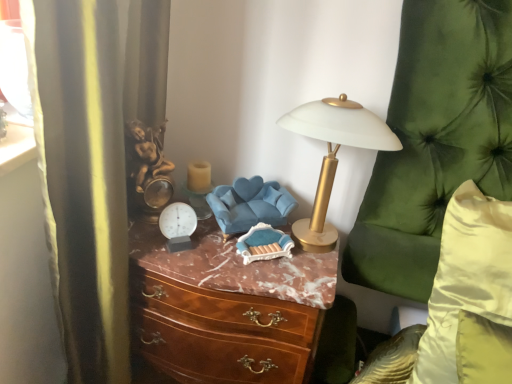
What do you see at coordinates (199, 187) in the screenshot? The width and height of the screenshot is (512, 384). I see `translucent glass candle at center` at bounding box center [199, 187].

What do you see at coordinates (250, 204) in the screenshot? I see `blue fabric swivel chair at center` at bounding box center [250, 204].

This screenshot has width=512, height=384. Describe the element at coordinates (466, 278) in the screenshot. I see `silky yellow pillow at right` at that location.

This screenshot has height=384, width=512. In order to click on silky yellow pillow at right in this screenshot , I will do `click(466, 278)`.

This screenshot has height=384, width=512. What do you see at coordinates (333, 155) in the screenshot? I see `gold metallic table lamp at upper center` at bounding box center [333, 155].

The image size is (512, 384). I want to click on translucent glass candle at center, so click(x=199, y=187).

Based on the photo, which of these two, translucent glass candle at center or marble/wooden chest of drawers at center, is smaller?

translucent glass candle at center is smaller.

How much distance is there between translucent glass candle at center and marble/wooden chest of drawers at center?

A distance of 11.73 inches exists between translucent glass candle at center and marble/wooden chest of drawers at center.

Locate an element on the screen. the chest of drawers that appears in front of the translucent glass candle at center is located at coordinates tap(226, 308).

What are the coordinates of `lamp above the blue fabric swivel chair at center (from the image's perspective)` in the screenshot? It's located at coord(333,155).

Between blue fabric swivel chair at center and gold metallic table lamp at upper center, which one appears on the left side from the viewer's perspective?

Positioned to the left is blue fabric swivel chair at center.

Considering the positions of objects blue fabric swivel chair at center and gold metallic table lamp at upper center in the image provided, who is in front, blue fabric swivel chair at center or gold metallic table lamp at upper center?

gold metallic table lamp at upper center is closer to the camera.

Between blue fabric swivel chair at center and gold metallic table lamp at upper center, which one has smaller width?

blue fabric swivel chair at center is thinner.

From a real-world perspective, is translucent glass candle at center located beneath silky yellow pillow at right?

Incorrect, from a real-world perspective, translucent glass candle at center is higher than silky yellow pillow at right.

From the image's perspective, which is below, translucent glass candle at center or silky yellow pillow at right?

silky yellow pillow at right, from the image's perspective.

Considering the relative sizes of translucent glass candle at center and silky yellow pillow at right in the image provided, is translucent glass candle at center shorter than silky yellow pillow at right?

Indeed, translucent glass candle at center has a lesser height compared to silky yellow pillow at right.

Is translucent glass candle at center next to silky yellow pillow at right and touching it?

No, translucent glass candle at center is not in contact with silky yellow pillow at right.

Which of these two, blue fabric swivel chair at center or silky yellow pillow at right, stands taller?

silky yellow pillow at right.

From the image's perspective, is blue fabric swivel chair at center above or below silky yellow pillow at right?

blue fabric swivel chair at center is above silky yellow pillow at right.

Which object is positioned more to the left, marble/wooden chest of drawers at center or translucent glass candle at center?

translucent glass candle at center is more to the left.

Which of these two, marble/wooden chest of drawers at center or translucent glass candle at center, is wider?

marble/wooden chest of drawers at center is wider.

Is marble/wooden chest of drawers at center smaller than translucent glass candle at center?

Actually, marble/wooden chest of drawers at center might be larger than translucent glass candle at center.

Is point (310, 286) farther from camera compared to point (196, 180)?

No, (310, 286) is closer to viewer.

Considering the sizes of translucent glass candle at center and gold metallic table lamp at upper center in the image, is translucent glass candle at center taller or shorter than gold metallic table lamp at upper center?

translucent glass candle at center is shorter than gold metallic table lamp at upper center.

Consider the image. Which object is wider, translucent glass candle at center or gold metallic table lamp at upper center?

Wider between the two is gold metallic table lamp at upper center.

Choose the correct answer: Is translucent glass candle at center inside gold metallic table lamp at upper center or outside it?

translucent glass candle at center cannot be found inside gold metallic table lamp at upper center.

From a real-world perspective, is translucent glass candle at center under gold metallic table lamp at upper center?

Yes, from a real-world perspective, translucent glass candle at center is beneath gold metallic table lamp at upper center.

How far apart are blue fabric swivel chair at center and translucent glass candle at center?

4.74 inches.

Is translucent glass candle at center inside blue fabric swivel chair at center?

No, translucent glass candle at center is not surrounded by blue fabric swivel chair at center.

Can you tell me how much blue fabric swivel chair at center and translucent glass candle at center differ in facing direction?

The angular difference between blue fabric swivel chair at center and translucent glass candle at center is 1.71 degrees.

In the scene shown: From the image's perspective, is blue fabric swivel chair at center above or below translucent glass candle at center?

From the image's perspective, blue fabric swivel chair at center appears below translucent glass candle at center.

Identify the location of candle holder on the left of marble/wooden chest of drawers at center. (199, 187).

Locate an element on the screen. The height and width of the screenshot is (384, 512). swivel chair that appears below the gold metallic table lamp at upper center (from a real-world perspective) is located at coordinates (250, 204).

Estimate the real-world distances between objects in this image. Which object is further from gold metallic table lamp at upper center, silky yellow pillow at right or blue fabric swivel chair at center?

The object further to gold metallic table lamp at upper center is silky yellow pillow at right.

When comparing their distances from marble/wooden chest of drawers at center, does silky yellow pillow at right or blue fabric swivel chair at center seem closer?

blue fabric swivel chair at center lies closer to marble/wooden chest of drawers at center than the other object.

Based on the photo, considering their positions, is silky yellow pillow at right positioned closer to blue fabric swivel chair at center than marble/wooden chest of drawers at center?

marble/wooden chest of drawers at center is closer to blue fabric swivel chair at center.

Estimate the real-world distances between objects in this image. Which object is further from silky yellow pillow at right, blue fabric swivel chair at center or marble/wooden chest of drawers at center?

The object further to silky yellow pillow at right is blue fabric swivel chair at center.

When comparing their distances from translucent glass candle at center, does gold metallic table lamp at upper center or marble/wooden chest of drawers at center seem further?

The object further to translucent glass candle at center is gold metallic table lamp at upper center.

In the scene shown: Which object lies further to the anchor point marble/wooden chest of drawers at center, silky yellow pillow at right or gold metallic table lamp at upper center?

silky yellow pillow at right is further to marble/wooden chest of drawers at center.

Which object lies nearer to the anchor point marble/wooden chest of drawers at center, gold metallic table lamp at upper center or translucent glass candle at center?

gold metallic table lamp at upper center is positioned closer to the anchor marble/wooden chest of drawers at center.

Which object lies nearer to the anchor point translucent glass candle at center, blue fabric swivel chair at center or gold metallic table lamp at upper center?

blue fabric swivel chair at center is closer to translucent glass candle at center.

Locate an element on the screen. The image size is (512, 384). swivel chair between gold metallic table lamp at upper center and marble/wooden chest of drawers at center in the up-down direction is located at coordinates (250, 204).

Find the location of a particular element. chest of drawers between translucent glass candle at center and silky yellow pillow at right is located at coordinates (226, 308).

Where is `lamp located between translucent glass candle at center and silky yellow pillow at right in the left-right direction`? lamp located between translucent glass candle at center and silky yellow pillow at right in the left-right direction is located at coordinates (333, 155).

Find the location of a particular element. The height and width of the screenshot is (384, 512). swivel chair situated between translucent glass candle at center and silky yellow pillow at right from left to right is located at coordinates [250, 204].